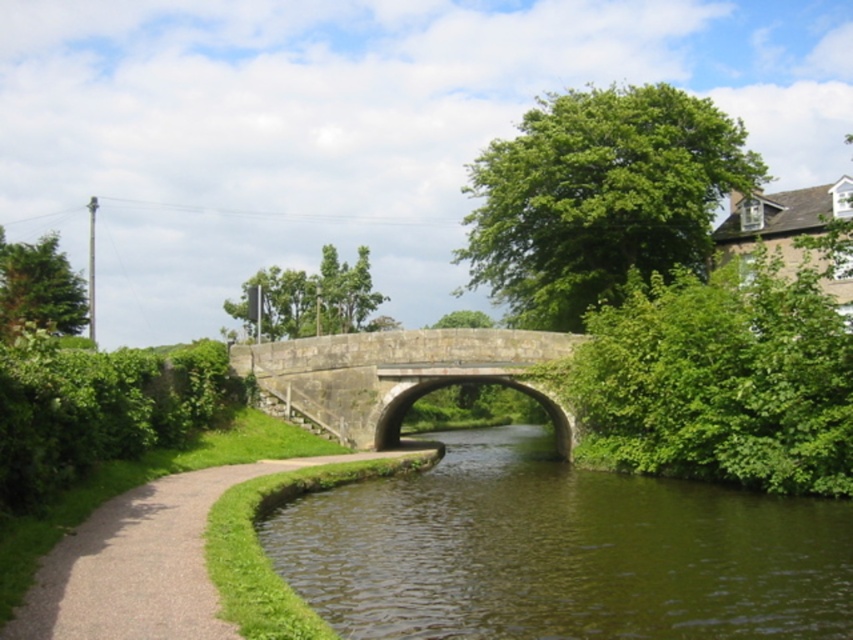
Question: Does paved gravel path at lower left come behind stone bridge at center?

Choices:
 (A) yes
 (B) no

Answer: (B)

Question: Does green smooth water at center have a lesser width compared to stone bridge at center?

Choices:
 (A) no
 (B) yes

Answer: (A)

Question: Estimate the real-world distances between objects in this image. Which object is farther from the stone bridge at center?

Choices:
 (A) green smooth water at center
 (B) paved gravel path at lower left

Answer: (B)

Question: Which object appears closest to the camera in this image?

Choices:
 (A) stone bridge at center
 (B) paved gravel path at lower left
 (C) green smooth water at center

Answer: (B)

Question: Is green smooth water at center below paved gravel path at lower left?

Choices:
 (A) no
 (B) yes

Answer: (B)

Question: Among these points, which one is nearest to the camera?

Choices:
 (A) (746, 598)
 (B) (186, 525)
 (C) (421, 356)

Answer: (A)